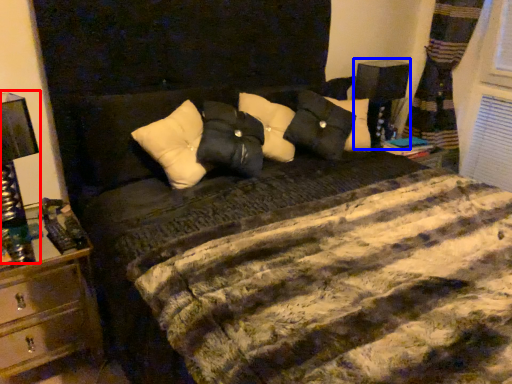
Question: Which object is closer to the camera taking this photo, bedside lamp (highlighted by a red box) or bedside lamp (highlighted by a blue box)?

Choices:
 (A) bedside lamp
 (B) bedside lamp

Answer: (A)